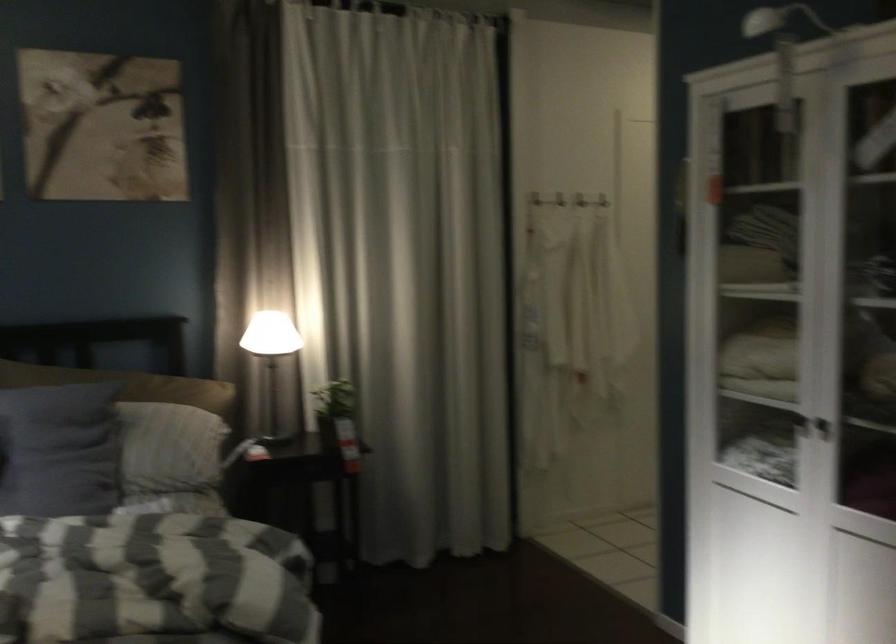
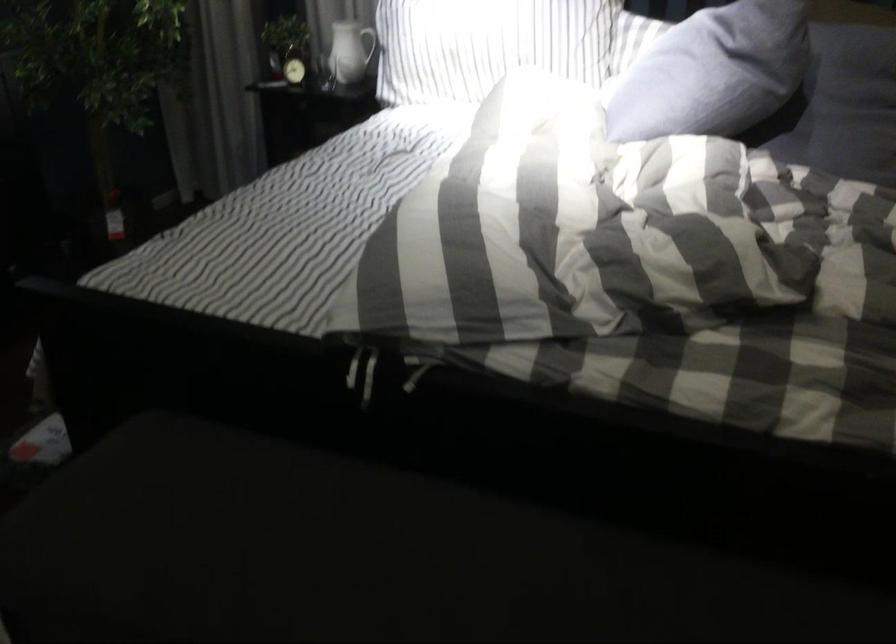
First-person continuous shooting, in which direction is the camera rotating?

The rotation direction of the camera is left-down.